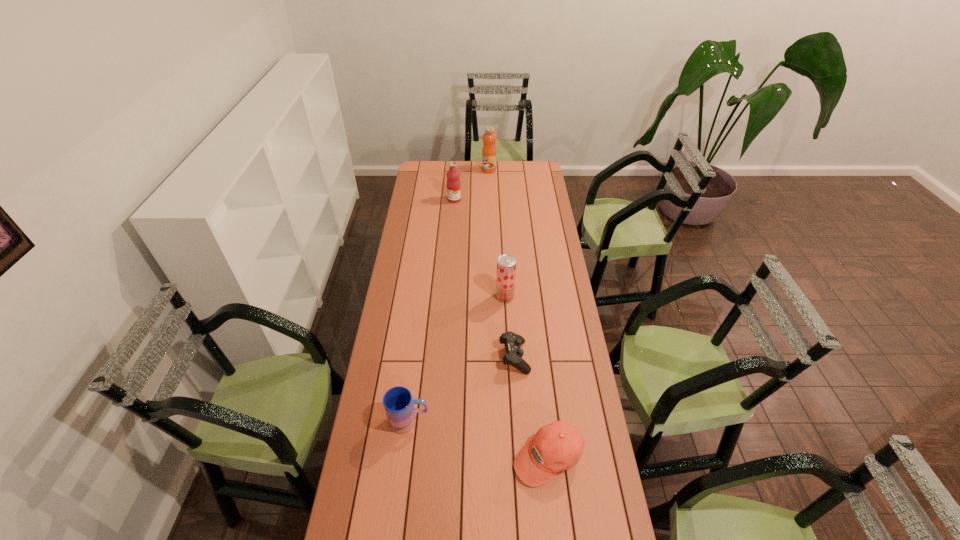
Point out which object is positioned as the third nearest to the third farthest object. Please provide its 2D coordinates. Your answer should be formatted as a tuple, i.e. [(x, y)], where the tuple contains the x and y coordinates of a point satisfying the conditions above.

[(557, 446)]

You are a GUI agent. You are given a task and a screenshot of the screen. Output one action in this format:
    pyautogui.click(x=<x>, y=<y>)
    Task: Click on the closest fruit juice relative to the second nearest fruit juice
    
    Given the screenshot: What is the action you would take?
    pyautogui.click(x=489, y=137)

Locate which fruit juice is the closest to the mug. Please provide its 2D coordinates. Your answer should be formatted as a tuple, i.e. [(x, y)], where the tuple contains the x and y coordinates of a point satisfying the conditions above.

[(506, 264)]

Identify the location of free location that satisfies the following two spatial constraints: 1. on the label of the second farthest object; 2. on the back side of the fifth tallest object. The image size is (960, 540). (436, 456).

Where is `free space that satisfies the following two spatial constraints: 1. on the label of the leftmost fruit juice; 2. on the back side of the baseball cap`? free space that satisfies the following two spatial constraints: 1. on the label of the leftmost fruit juice; 2. on the back side of the baseball cap is located at coordinates (436, 456).

Where is `vacant area that satisfies the following two spatial constraints: 1. on the back side of the third farthest object; 2. on the label of the fifth nearest object`? The width and height of the screenshot is (960, 540). vacant area that satisfies the following two spatial constraints: 1. on the back side of the third farthest object; 2. on the label of the fifth nearest object is located at coordinates (499, 199).

You are a GUI agent. You are given a task and a screenshot of the screen. Output one action in this format:
    pyautogui.click(x=<x>, y=<y>)
    Task: Click on the blank area in the image that satisfies the following two spatial constraints: 1. on the front side of the baseball cap; 2. on the right side of the fourth nearest object
    The height and width of the screenshot is (540, 960).
    Given the screenshot: What is the action you would take?
    pyautogui.click(x=514, y=456)

Identify the location of free spot that satisfies the following two spatial constraints: 1. on the front side of the farthest object; 2. on the left side of the control. (494, 357).

Find the location of a particular element. This screenshot has width=960, height=540. free space in the image that satisfies the following two spatial constraints: 1. on the front side of the nearest fruit juice; 2. on the side of the mug with the handle is located at coordinates (512, 421).

Locate an element on the screen. The image size is (960, 540). blank area in the image that satisfies the following two spatial constraints: 1. on the label of the third nearest object; 2. on the left side of the leftmost fruit juice is located at coordinates (443, 357).